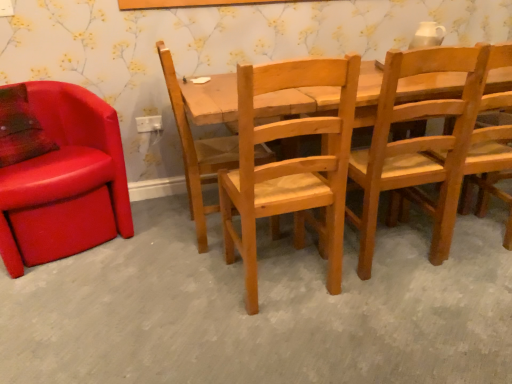
Where is `vacant area that lies between wooden chair at center, positioned as the fourth chair in left-to-right order, and light brown wood chair at right, arranged as the fifth chair when viewed from the left`? Image resolution: width=512 pixels, height=384 pixels. vacant area that lies between wooden chair at center, positioned as the fourth chair in left-to-right order, and light brown wood chair at right, arranged as the fifth chair when viewed from the left is located at coordinates [x=457, y=251].